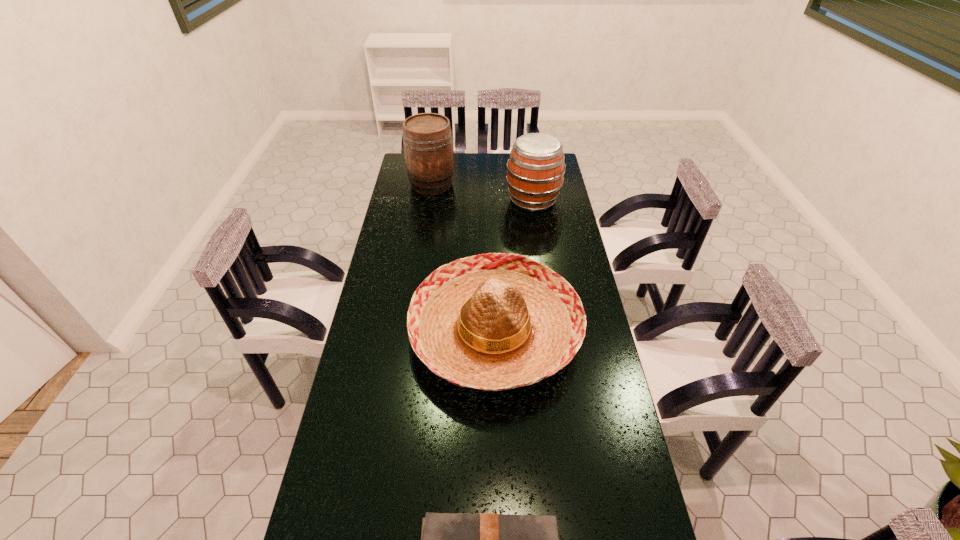
You are a GUI agent. You are given a task and a screenshot of the screen. Output one action in this format:
    pyautogui.click(x=<x>, y=<y>)
    Task: Click on the sombrero that is at the right edge
    
    Given the screenshot: What is the action you would take?
    pyautogui.click(x=497, y=321)

Identify the location of object that is at the far left corner. This screenshot has height=540, width=960. (427, 137).

Where is `free space at the left edge of the desktop`? free space at the left edge of the desktop is located at coordinates (355, 534).

I want to click on vacant region at the right edge of the desktop, so click(x=572, y=364).

I want to click on vacant point located between the third tallest object and the left cider, so click(x=464, y=258).

Find the location of a particular element. The image size is (960, 540). blank region between the third farthest object and the left cider is located at coordinates pos(464,258).

Where is `object that is the third closest to the left cider`? The height and width of the screenshot is (540, 960). object that is the third closest to the left cider is located at coordinates (447, 539).

Where is `object that stands as the third closest to the third farthest object`? object that stands as the third closest to the third farthest object is located at coordinates (427, 137).

I want to click on free space in the image that satisfies the following two spatial constraints: 1. on the side of the second nearest object near the bung hole; 2. on the left side of the left cider, so click(x=411, y=332).

Locate an element on the screen. free space that satisfies the following two spatial constraints: 1. on the side of the right cider near the bung hole; 2. on the left side of the left cider is located at coordinates (429, 200).